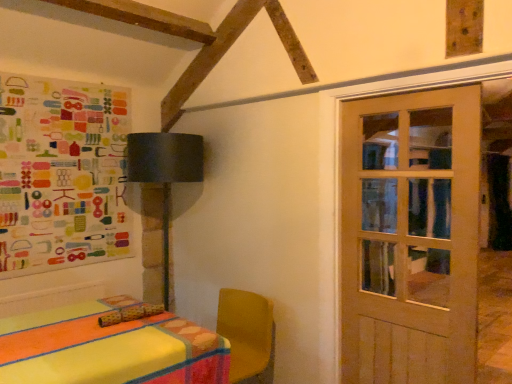
Question: Is wooden door at right turned away from colorful paper collage at upper left?

Choices:
 (A) yes
 (B) no

Answer: (B)

Question: Is wooden door at right far away from colorful paper collage at upper left?

Choices:
 (A) no
 (B) yes

Answer: (B)

Question: Is wooden door at right to the left of colorful paper collage at upper left from the viewer's perspective?

Choices:
 (A) yes
 (B) no

Answer: (B)

Question: From a real-world perspective, is wooden door at right on colorful paper collage at upper left?

Choices:
 (A) no
 (B) yes

Answer: (A)

Question: Can you confirm if wooden door at right is shorter than colorful paper collage at upper left?

Choices:
 (A) no
 (B) yes

Answer: (A)

Question: Looking at the image, does wooden door at right seem bigger or smaller compared to matte black lampshade at upper left?

Choices:
 (A) small
 (B) big

Answer: (A)

Question: Is wooden door at right inside or outside of matte black lampshade at upper left?

Choices:
 (A) inside
 (B) outside

Answer: (B)

Question: From the image's perspective, is wooden door at right above or below matte black lampshade at upper left?

Choices:
 (A) above
 (B) below

Answer: (B)

Question: From a real-world perspective, is wooden door at right physically located above or below matte black lampshade at upper left?

Choices:
 (A) below
 (B) above

Answer: (B)

Question: Considering their positions, is colorful paper collage at upper left located in front of or behind wooden door at right?

Choices:
 (A) behind
 (B) front

Answer: (A)

Question: Based on their positions, is colorful paper collage at upper left located to the left or right of wooden door at right?

Choices:
 (A) right
 (B) left

Answer: (B)

Question: Looking at the image, does colorful paper collage at upper left seem bigger or smaller compared to wooden door at right?

Choices:
 (A) small
 (B) big

Answer: (B)

Question: Considering the positions of colorful paper collage at upper left and wooden door at right in the image, is colorful paper collage at upper left wider or thinner than wooden door at right?

Choices:
 (A) thin
 (B) wide

Answer: (B)

Question: Is point (132, 137) closer or farther from the camera than point (115, 177)?

Choices:
 (A) farther
 (B) closer

Answer: (B)

Question: From a real-world perspective, is matte black lampshade at upper left above or below colorful paper collage at upper left?

Choices:
 (A) above
 (B) below

Answer: (B)